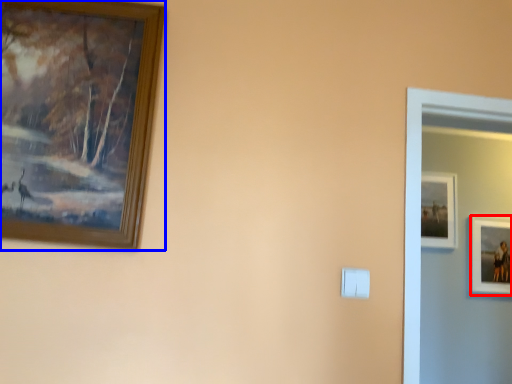
Question: Which object is further to the camera taking this photo, picture frame (highlighted by a red box) or picture frame (highlighted by a blue box)?

Choices:
 (A) picture frame
 (B) picture frame

Answer: (A)